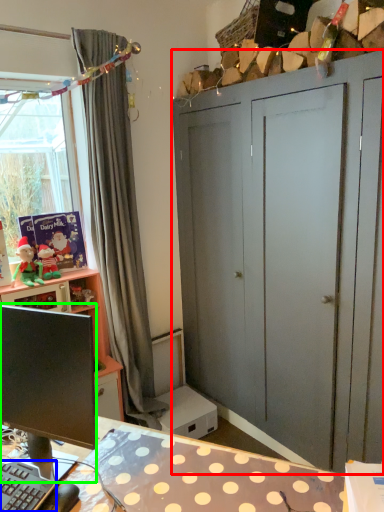
Question: Which object is the farthest from dresser (highlighted by a red box)? Choose among these: computer keyboard (highlighted by a blue box) or computer monitor (highlighted by a green box).

Choices:
 (A) computer keyboard
 (B) computer monitor

Answer: (A)